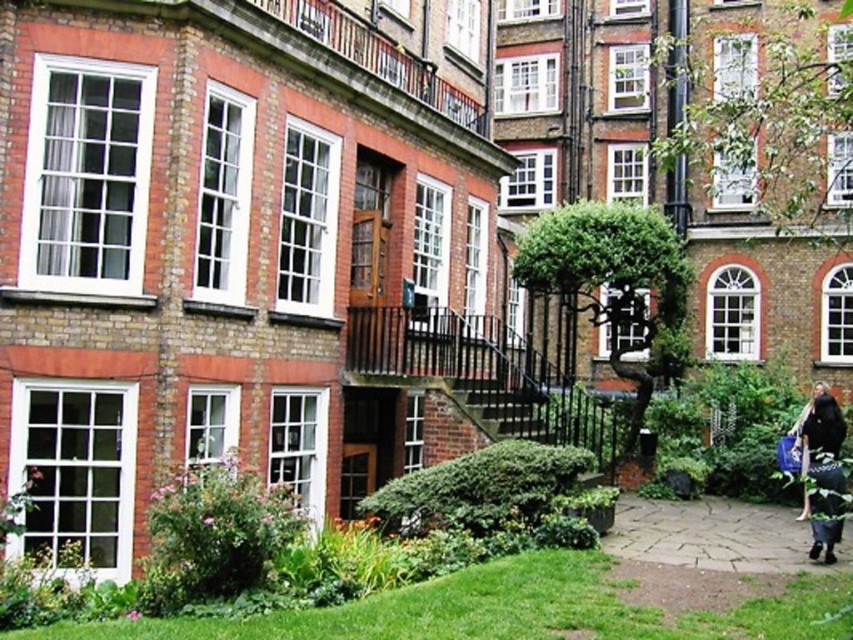
You are standing in the courtyard and want to pick up the dark blue fabric bag at lower right. Which direction should you move to reach it from the smooth stone path at lower right?

The smooth stone path at lower right is below the dark blue fabric bag at lower right, so you should move upward to reach the dark blue fabric bag at lower right from the path.

You are a delivery person arriving at this courtyard. You need to place a large package on the ground near the dark blue fabric bag at lower right. However, you must ensure it doesn not block the smooth stone path at lower right. Given the sizes of the objects, where should you place the package?

The smooth stone path at lower right is larger than the dark blue fabric bag at lower right. To avoid blocking the path, place the large package near the dark blue fabric bag at lower right but keep it away from the larger smooth stone path at lower right.